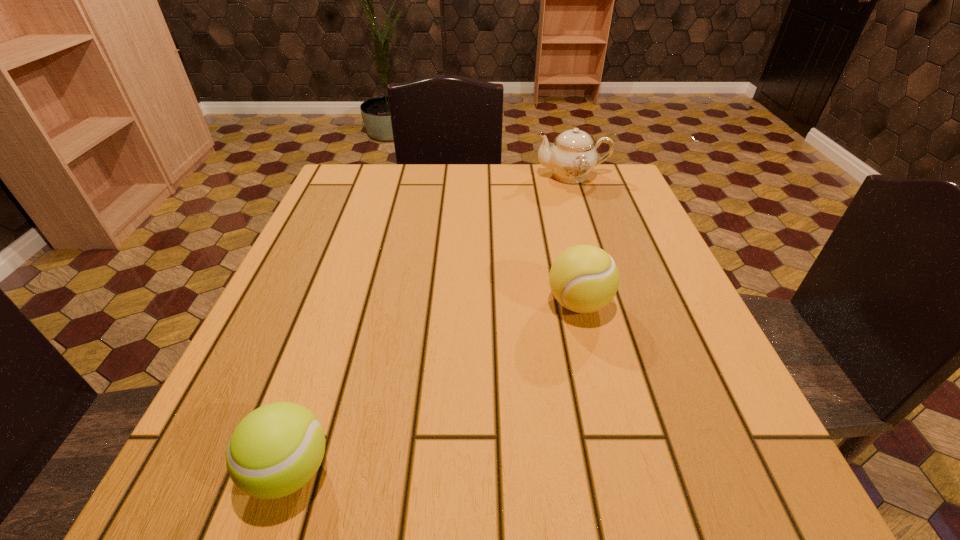
Find the location of a particular element. the farthest object is located at coordinates (572, 156).

Where is `the right tennis ball`? This screenshot has width=960, height=540. the right tennis ball is located at coordinates (584, 278).

The image size is (960, 540). Find the location of `the farther tennis ball`. the farther tennis ball is located at coordinates (584, 278).

Find the location of a particular element. the leftmost object is located at coordinates (276, 449).

This screenshot has height=540, width=960. Identify the location of the left tennis ball. (276, 449).

The height and width of the screenshot is (540, 960). In order to click on free space located at the spout of the farthest object in this screenshot , I will do `click(419, 176)`.

This screenshot has width=960, height=540. In order to click on blank area located at the spout of the farthest object in this screenshot , I will do `click(460, 176)`.

This screenshot has width=960, height=540. Find the location of `vacant space located 0.110m at the spout of the farthest object`. vacant space located 0.110m at the spout of the farthest object is located at coordinates (493, 176).

Locate an element on the screen. This screenshot has width=960, height=540. free location located 0.100m on the front of the second farthest object is located at coordinates (596, 375).

Identify the location of vacant space located 0.270m on the back of the leftmost object. This screenshot has height=540, width=960. (347, 298).